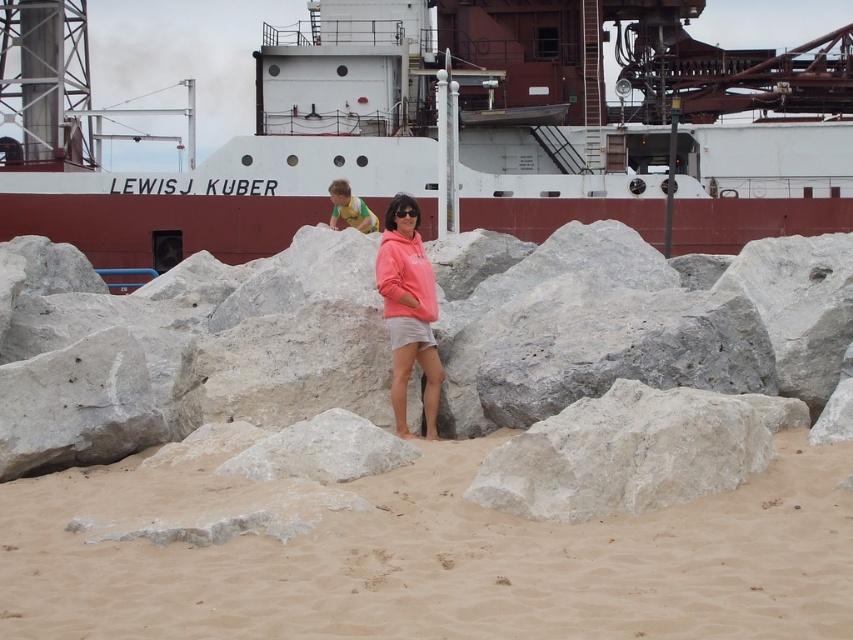
Can you confirm if white matte ship at upper center is positioned to the right of matte pink hoodie at center?

Yes, white matte ship at upper center is to the right of matte pink hoodie at center.

Is white matte ship at upper center shorter than matte pink hoodie at center?

No.

Where is `white matte ship at upper center`? The width and height of the screenshot is (853, 640). white matte ship at upper center is located at coordinates (488, 132).

Find the location of a particular element. white matte ship at upper center is located at coordinates (488, 132).

Does point (332, 548) lie behind point (428, 348)?

No, (332, 548) is closer to viewer.

Image resolution: width=853 pixels, height=640 pixels. Identify the location of beige sand at lower center. (436, 561).

Which is more to the left, white matte ship at upper center or beige sand at lower center?

Positioned to the left is beige sand at lower center.

Does white matte ship at upper center have a smaller size compared to beige sand at lower center?

No, white matte ship at upper center is not smaller than beige sand at lower center.

Who is more distant from viewer, (656, 157) or (740, 545)?

The point (656, 157) is more distant.

Where is `white matte ship at upper center`? The height and width of the screenshot is (640, 853). white matte ship at upper center is located at coordinates (488, 132).